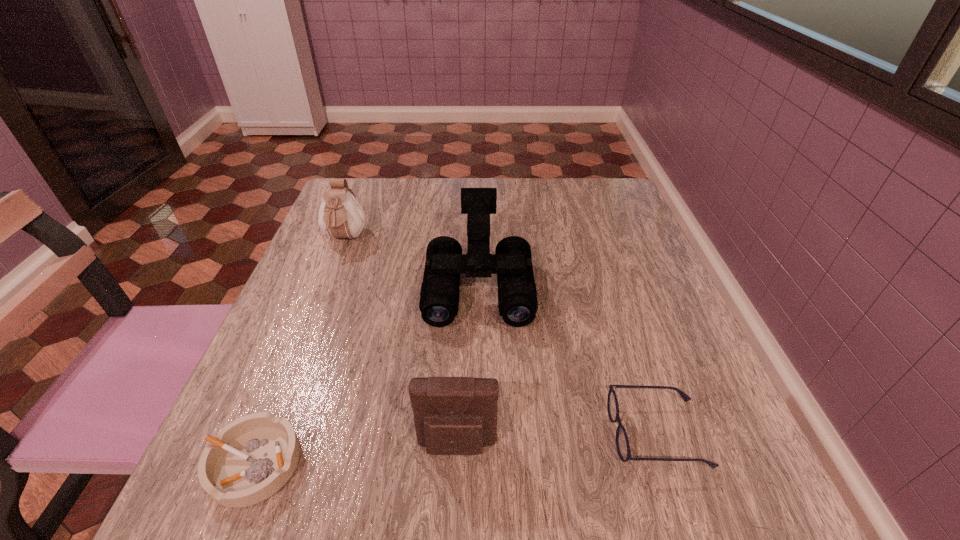
The height and width of the screenshot is (540, 960). Identify the location of binoculars. (512, 262).

Locate an element on the screen. The width and height of the screenshot is (960, 540). the left pouch is located at coordinates (340, 215).

You are a GUI agent. You are given a task and a screenshot of the screen. Output one action in this format:
    pyautogui.click(x=<x>, y=<y>)
    Task: Click on the nearer pouch
    The height and width of the screenshot is (540, 960).
    Given the screenshot: What is the action you would take?
    pyautogui.click(x=452, y=415)

The image size is (960, 540). I want to click on the rightmost object, so click(x=622, y=443).

At what (x,y) coordinates should I click in order to perform the action: click on spectacles. Please return your answer as a coordinate pair (x, y). Looking at the image, I should click on pos(622,443).

You are a GUI agent. You are given a task and a screenshot of the screen. Output one action in this format:
    pyautogui.click(x=<x>, y=<y>)
    Task: Click on the shortest object
    
    Given the screenshot: What is the action you would take?
    pyautogui.click(x=254, y=456)

The width and height of the screenshot is (960, 540). In order to click on free spot located on the front lenses of the binoculars in this screenshot , I will do `click(478, 463)`.

Find the location of `vacant area situated on the front-facing side of the left pouch`. vacant area situated on the front-facing side of the left pouch is located at coordinates (320, 305).

Locate an element on the screen. The height and width of the screenshot is (540, 960). vacant region located on the front-facing side of the fourth tallest object is located at coordinates (489, 433).

Identify the location of free spot located on the front-facing side of the fourth tallest object. The height and width of the screenshot is (540, 960). (418, 433).